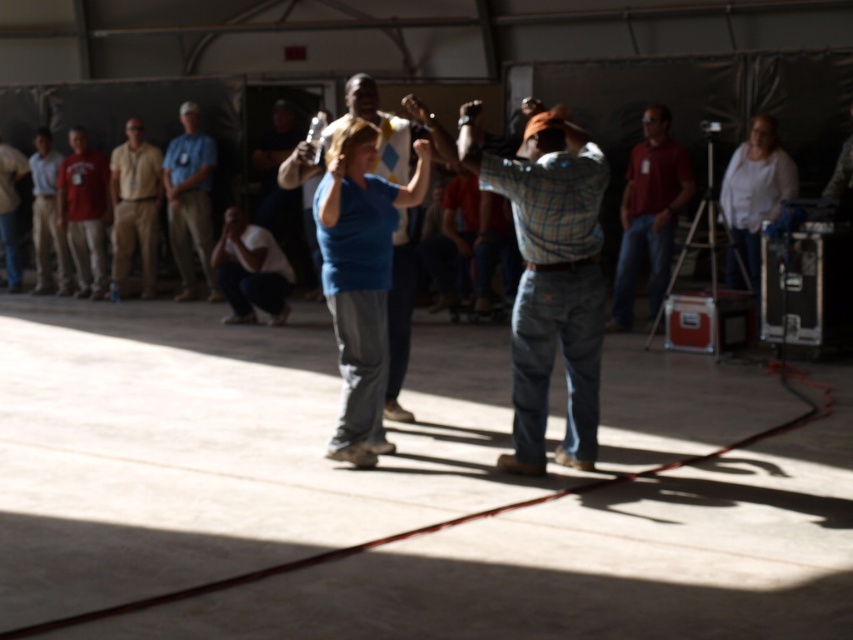
Consider the image. Is white cotton shirt at lower center positioned before matte red shirt at left?

Yes, it is in front of matte red shirt at left.

Consider the image. Does white cotton shirt at lower center have a larger size compared to matte red shirt at left?

Yes, white cotton shirt at lower center is bigger than matte red shirt at left.

What are the coordinates of `white cotton shirt at lower center` in the screenshot? It's located at (251, 269).

Is white cotton shirt at right above light blue shirt at left?

Actually, white cotton shirt at right is below light blue shirt at left.

Does white cotton shirt at right lie in front of light blue shirt at left?

Yes.

Measure the distance between white cotton shirt at right and camera.

white cotton shirt at right is 12.62 meters from camera.

Locate an element on the screen. The image size is (853, 640). white cotton shirt at right is located at coordinates (756, 188).

Is plaid shirt at center closer to the viewer compared to matte khaki pants at left?

Yes.

Is plaid shirt at center shorter than matte khaki pants at left?

In fact, plaid shirt at center may be taller than matte khaki pants at left.

Between point (596, 250) and point (15, 280), which one is positioned in front?

Point (596, 250)

Find the location of a particular element. This screenshot has height=640, width=853. plaid shirt at center is located at coordinates (549, 280).